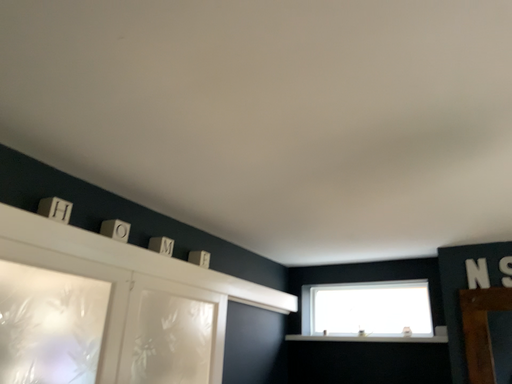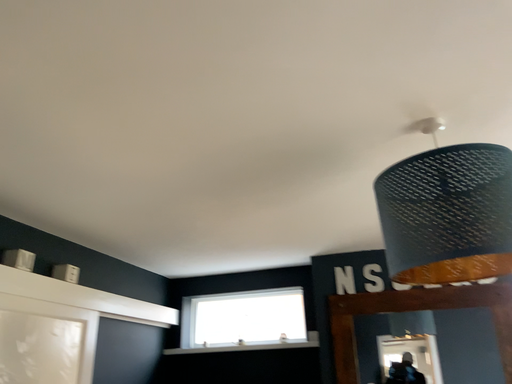
Question: How did the camera likely rotate when shooting the video?

Choices:
 (A) rotated left
 (B) rotated right

Answer: (B)